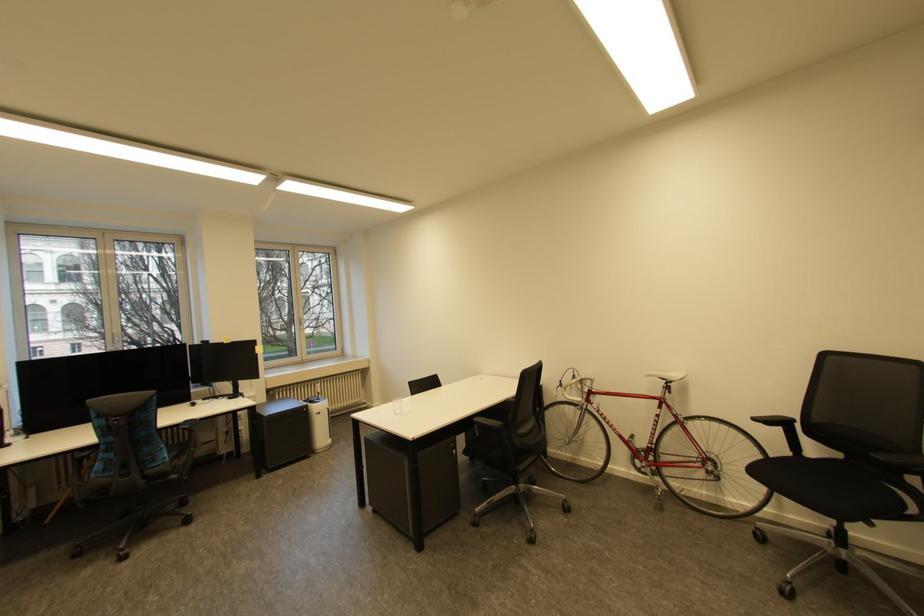
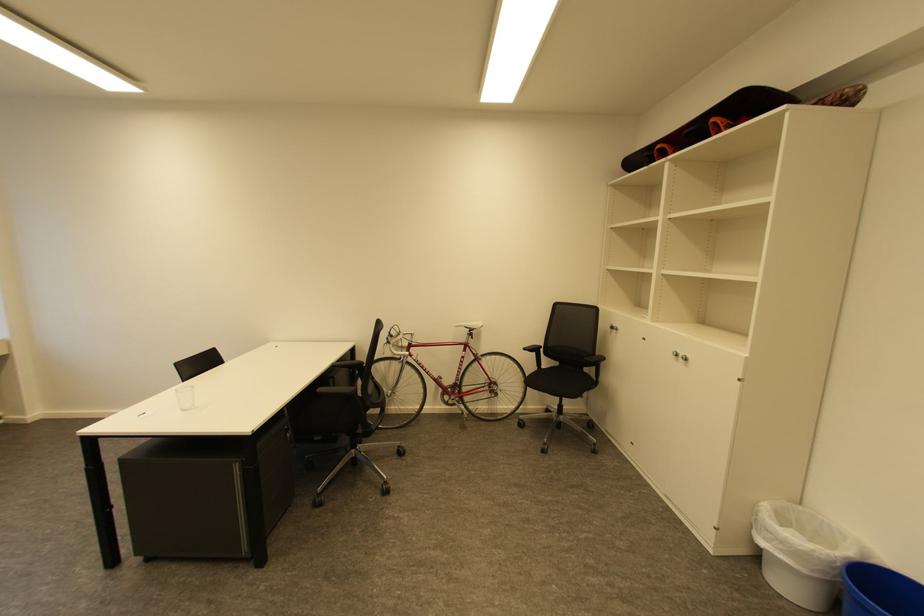
The point at (666, 408) is marked in the first image. Where is the corresponding point in the second image?

(471, 351)